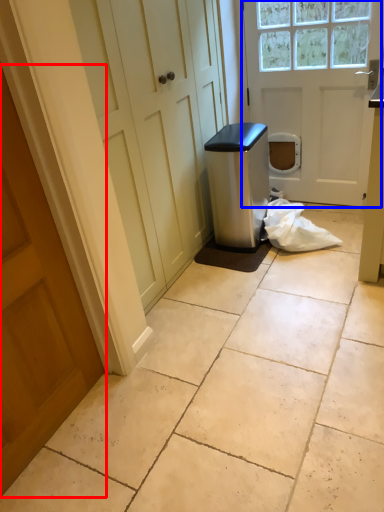
Question: Which object is further to the camera taking this photo, door (highlighted by a red box) or door (highlighted by a blue box)?

Choices:
 (A) door
 (B) door

Answer: (B)